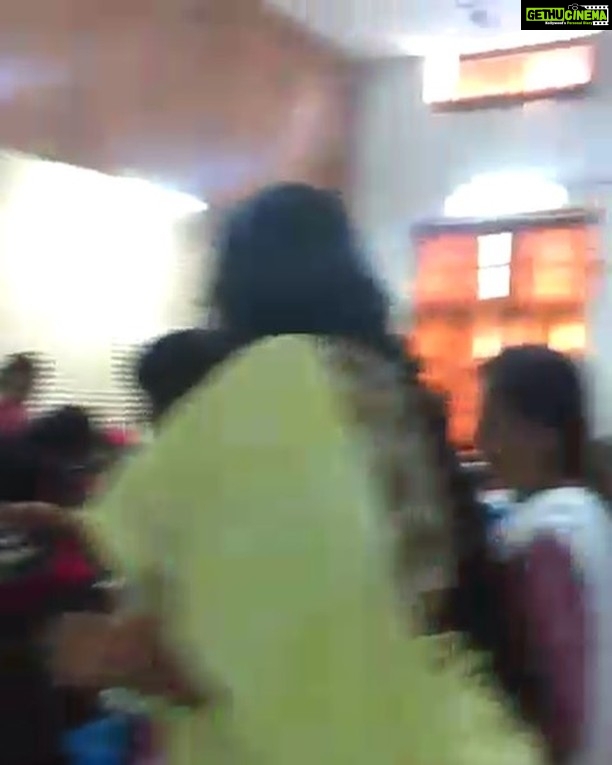
This screenshot has height=765, width=612. Find the location of `wall`. wall is located at coordinates (401, 170), (226, 164).